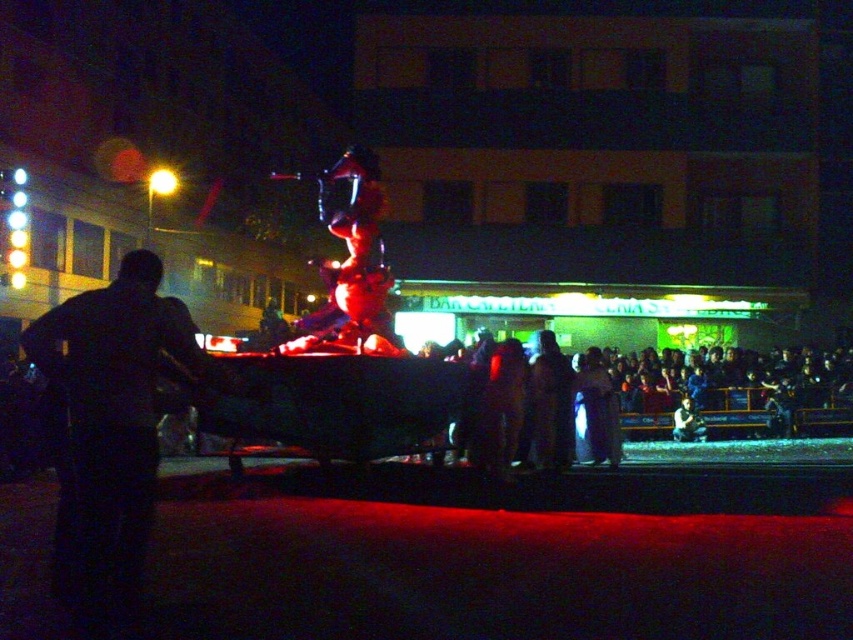
Measure the distance between black matte jacket at left and camera.

black matte jacket at left is 4.29 meters from camera.

What do you see at coordinates (109, 428) in the screenshot? The width and height of the screenshot is (853, 640). I see `black matte jacket at left` at bounding box center [109, 428].

You are a GUI agent. You are given a task and a screenshot of the screen. Output one action in this format:
    pyautogui.click(x=<x>, y=<y>)
    Task: Click on the black matte jacket at left
    
    Given the screenshot: What is the action you would take?
    pyautogui.click(x=109, y=428)

Image resolution: width=853 pixels, height=640 pixels. Identify the location of black matte jacket at left. (109, 428).

Identify the location of dark fabric dress at center. (550, 404).

Is dark fabric dress at center positioned at the back of smooth skin face at center?

No, dark fabric dress at center is closer to the viewer.

Is point (550, 440) farther from viewer compared to point (692, 410)?

No, (550, 440) is closer to viewer.

Find the location of a particular element. dark fabric dress at center is located at coordinates (550, 404).

Does dark clothing crowd at right lie behind dark fabric dress at center?

No, it is in front of dark fabric dress at center.

Is point (556, 369) closer to viewer compared to point (550, 384)?

No, (556, 369) is further to viewer.

In order to click on dark clothing crowd at right in this screenshot , I will do `click(682, 396)`.